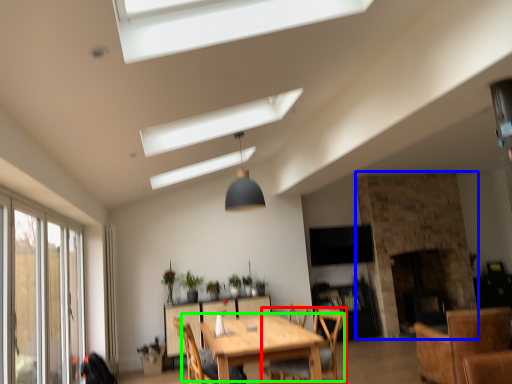
Question: Which object is positioned closest to chair (highlighted by a red box)? Select from fireplace (highlighted by a blue box) and kitchen & dining room table (highlighted by a green box).

Choices:
 (A) fireplace
 (B) kitchen & dining room table

Answer: (B)